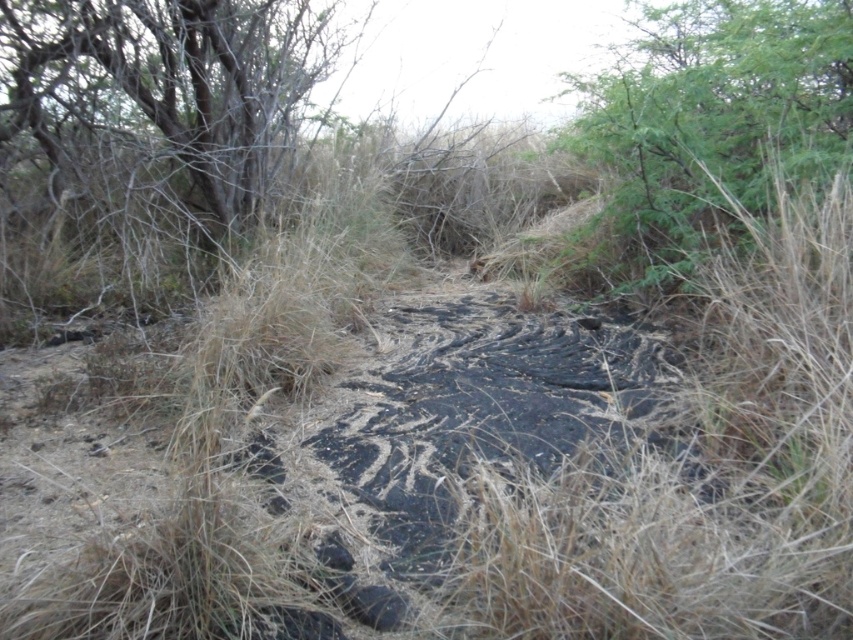
You are a hiker who wants to take a photo of the gray bark tree at upper left without the green leafy tree at upper right blocking the view. Which direction should you move to achieve this?

The green leafy tree at upper right is positioned over the gray bark tree at upper left, so moving to the left side of the gray bark tree at upper left would allow you to take a photo without the green leafy tree at upper right blocking the view.

You are a hiker trying to navigate between the green leafy tree at upper right and the gray bark tree at upper left. Which tree should you head towards if you want to move towards the right side of the scene?

You should head towards the green leafy tree at upper right because it is positioned on the right side of the gray bark tree at upper left.

You are a hiker who needs to find shade. You see a green leafy tree at upper right and a gray bark tree at upper left. Which tree would provide more shade?

The green leafy tree at upper right provides more shade because it is bigger than the gray bark tree at upper left.